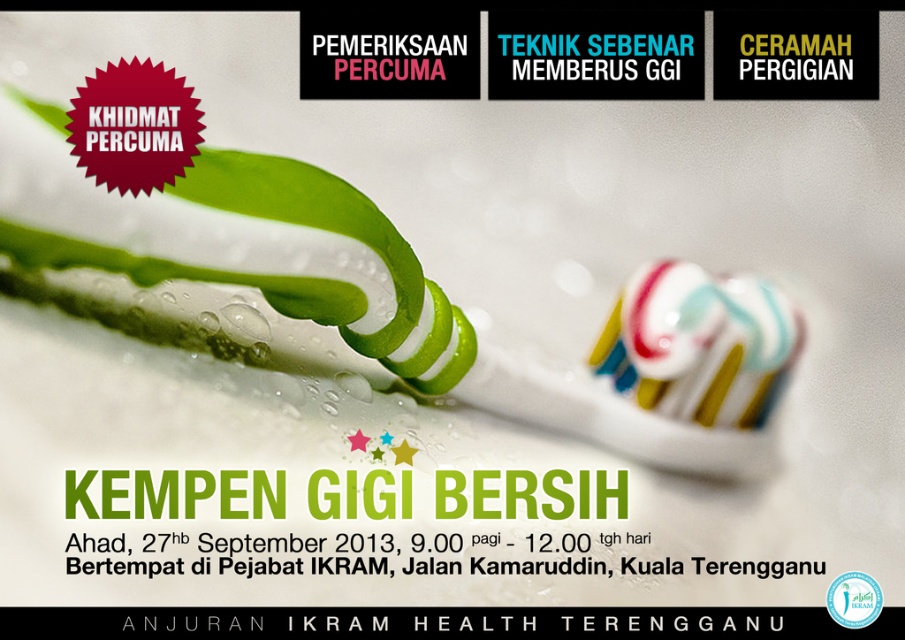
How much distance is there between green striped toothbrush at upper left and multicolored striped toothpaste at center?

The distance of green striped toothbrush at upper left from multicolored striped toothpaste at center is 8.23 centimeters.

Who is more distant from viewer, (582, 397) or (696, 296)?

The point (696, 296) is more distant.

The width and height of the screenshot is (905, 640). I want to click on green striped toothbrush at upper left, so click(x=410, y=296).